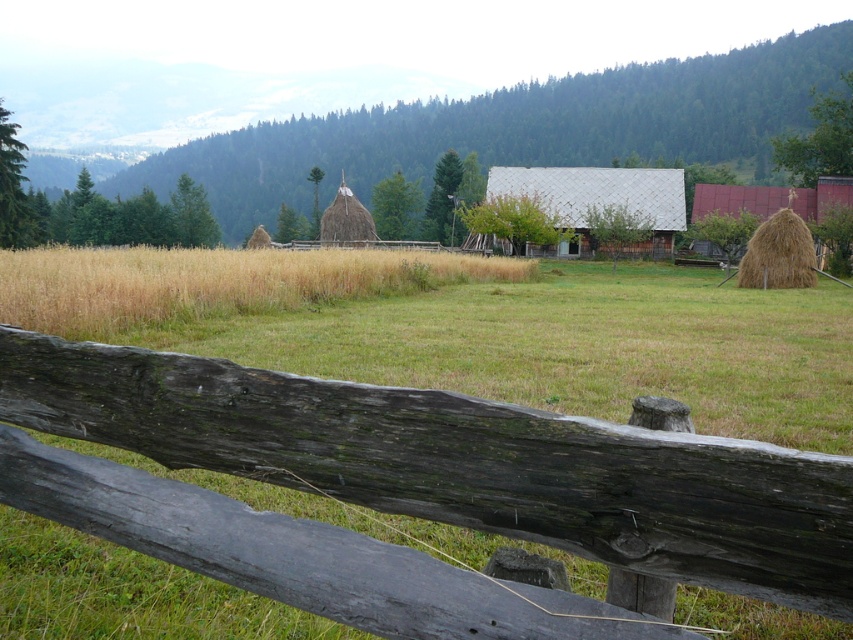
Between wooden planks barn at center and brown straw bale at right, which one appears on the left side from the viewer's perspective?

wooden planks barn at center is more to the left.

Measure the distance from wooden planks barn at center to brown straw bale at right.

wooden planks barn at center is 22.67 meters away from brown straw bale at right.

Does point (625, 172) come behind point (809, 259)?

Yes, it is.

Locate an element on the screen. The height and width of the screenshot is (640, 853). wooden planks barn at center is located at coordinates (599, 202).

Does yellow dry grass at center appear on the right side of wooden planks barn at center?

In fact, yellow dry grass at center is to the left of wooden planks barn at center.

Does point (15, 275) come closer to viewer compared to point (654, 172)?

That is True.

At what (x,y) coordinates should I click in order to perform the action: click on yellow dry grass at center. Please return your answer as a coordinate pair (x, y). This screenshot has height=640, width=853. Looking at the image, I should click on (213, 282).

Is point (177, 376) closer to camera compared to point (781, 218)?

That is True.

Based on the photo, is weathered wood fence at center thinner than brown straw bale at right?

Correct, weathered wood fence at center's width is less than brown straw bale at right's.

Locate an element on the screen. This screenshot has width=853, height=640. weathered wood fence at center is located at coordinates (550, 474).